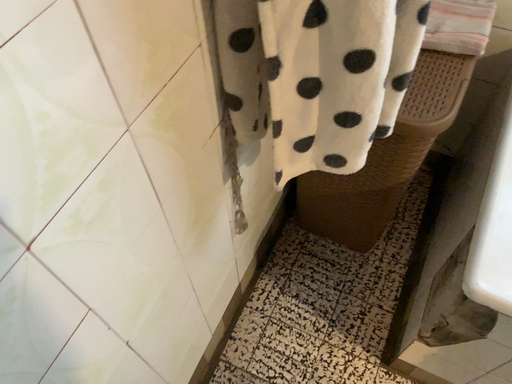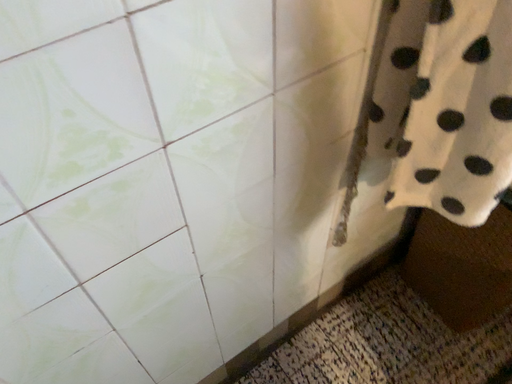
Question: Which way did the camera rotate in the video?

Choices:
 (A) rotated left
 (B) rotated right

Answer: (A)